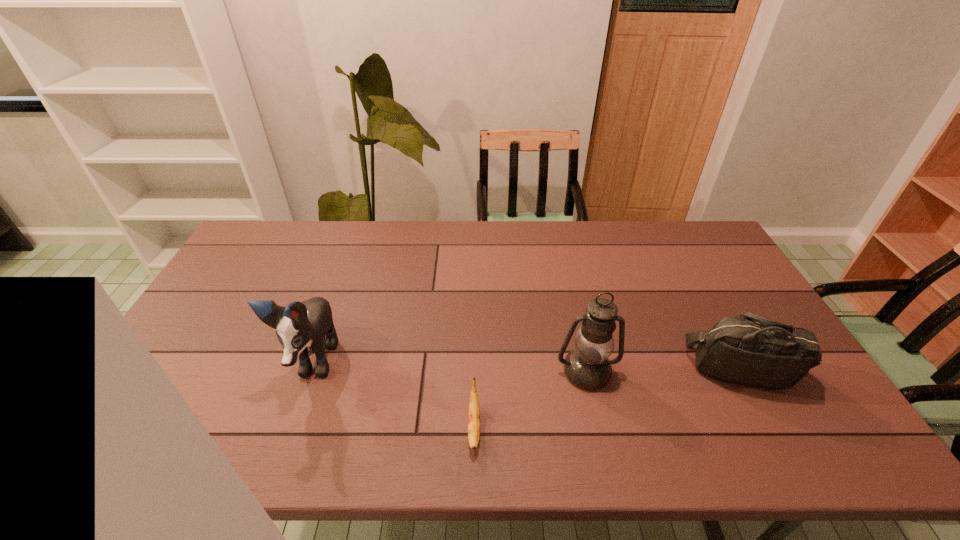
In order to click on puppy in this screenshot , I will do `click(304, 324)`.

Image resolution: width=960 pixels, height=540 pixels. What are the coordinates of `oil lamp` in the screenshot? It's located at (587, 366).

You are a GUI agent. You are given a task and a screenshot of the screen. Output one action in this format:
    pyautogui.click(x=<x>, y=<y>)
    Task: Click on the third tallest object
    This screenshot has height=540, width=960.
    Given the screenshot: What is the action you would take?
    pyautogui.click(x=751, y=350)

You are a GUI agent. You are given a task and a screenshot of the screen. Output one action in this format:
    pyautogui.click(x=<x>, y=<y>)
    Task: Click on the rightmost object
    This screenshot has height=540, width=960.
    Given the screenshot: What is the action you would take?
    pyautogui.click(x=751, y=350)

What are the coordinates of `the second object from left to right` in the screenshot? It's located at (474, 410).

Locate an element on the screen. This screenshot has height=540, width=960. the shortest object is located at coordinates (474, 410).

This screenshot has width=960, height=540. In order to click on blank area located 0.070m on the front-facing side of the leftmost object in this screenshot , I will do pyautogui.click(x=288, y=433).

Where is `vacant area situated on the back of the oil lamp`? vacant area situated on the back of the oil lamp is located at coordinates (578, 334).

Where is `vacant space located 0.160m at the front padded panel of the rightmost object`? vacant space located 0.160m at the front padded panel of the rightmost object is located at coordinates (790, 458).

The width and height of the screenshot is (960, 540). Identify the location of object present at the near edge. (474, 410).